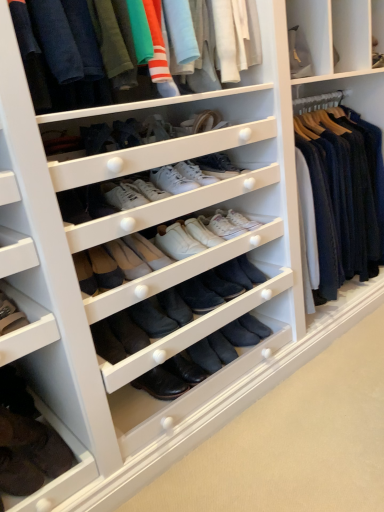
Question: Which direction should I rotate to face black leather boot at center, which appears as the 1th shoe when ordered from the bottom, — up or down?

Choices:
 (A) up
 (B) down

Answer: (B)

Question: Is black leather boot at center, positioned as the 5th shoe in top-to-bottom order, far from white leather sneakers at center, the third shoe when ordered from bottom to top?

Choices:
 (A) yes
 (B) no

Answer: (B)

Question: Is black leather boot at center, which appears as the 1th shoe when ordered from the bottom, wider than white leather sneakers at center, the third shoe when ordered from bottom to top?

Choices:
 (A) yes
 (B) no

Answer: (A)

Question: Considering the relative sizes of black leather boot at center, which appears as the 1th shoe when ordered from the bottom, and white leather sneakers at center, the 3th shoe viewed from the top, in the image provided, is black leather boot at center, which appears as the 1th shoe when ordered from the bottom, bigger than white leather sneakers at center, the 3th shoe viewed from the top,?

Choices:
 (A) no
 (B) yes

Answer: (A)

Question: Could you tell me if black leather boot at center, which appears as the 1th shoe when ordered from the bottom, is facing white leather sneakers at center, the 3th shoe viewed from the top?

Choices:
 (A) yes
 (B) no

Answer: (B)

Question: Is black leather boot at center, positioned as the 5th shoe in top-to-bottom order, to the right of white leather sneakers at center, the third shoe when ordered from bottom to top, from the viewer's perspective?

Choices:
 (A) yes
 (B) no

Answer: (A)

Question: Is black leather boot at center, which appears as the 1th shoe when ordered from the bottom, smaller than white leather sneakers at center, the third shoe when ordered from bottom to top?

Choices:
 (A) yes
 (B) no

Answer: (A)

Question: Is white leather sneakers at center, the fifth shoe when ordered from bottom to top, oriented towards black suede boot at center, positioned as the fourth shoe in top-to-bottom order?

Choices:
 (A) yes
 (B) no

Answer: (B)

Question: Is white leather sneakers at center, the fifth shoe when ordered from bottom to top, positioned far away from black suede boot at center, positioned as the fourth shoe in top-to-bottom order?

Choices:
 (A) yes
 (B) no

Answer: (B)

Question: Considering the relative sizes of white leather sneakers at center, the fifth shoe when ordered from bottom to top, and black suede boot at center, the second shoe from the bottom, in the image provided, is white leather sneakers at center, the fifth shoe when ordered from bottom to top, thinner than black suede boot at center, the second shoe from the bottom,?

Choices:
 (A) no
 (B) yes

Answer: (A)

Question: From a real-world perspective, does white leather sneakers at center, the fifth shoe when ordered from bottom to top, stand above black suede boot at center, positioned as the fourth shoe in top-to-bottom order?

Choices:
 (A) yes
 (B) no

Answer: (A)

Question: Can you confirm if white leather sneakers at center, the fifth shoe when ordered from bottom to top, is bigger than black suede boot at center, the second shoe from the bottom?

Choices:
 (A) no
 (B) yes

Answer: (B)

Question: Considering the relative positions of white leather sneakers at center, which is the first shoe in top-to-bottom order, and black suede boot at center, positioned as the fourth shoe in top-to-bottom order, in the image provided, is white leather sneakers at center, which is the first shoe in top-to-bottom order, in front of black suede boot at center, positioned as the fourth shoe in top-to-bottom order,?

Choices:
 (A) yes
 (B) no

Answer: (A)

Question: Does white leather sneakers at center, which ranks as the second shoe in top-to-bottom order, touch leather boot at lower left, which is the second footwear from bottom to top?

Choices:
 (A) no
 (B) yes

Answer: (A)